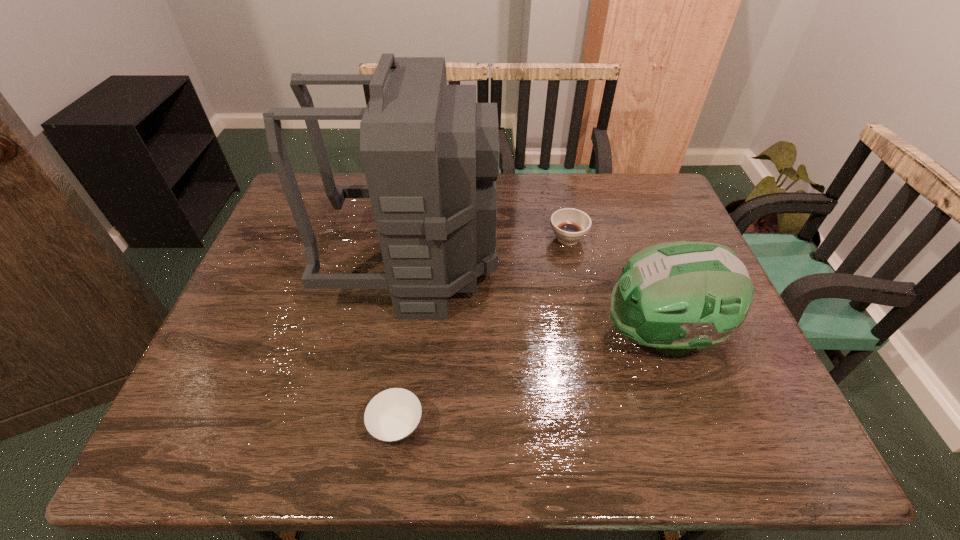
At what (x,y) coordinates should I click in order to perform the action: click on free spot located 0.310m on the back of the nearer soup bowl. Please return your answer as a coordinate pair (x, y). The width and height of the screenshot is (960, 540). Looking at the image, I should click on (416, 292).

Locate an element on the screen. object that is at the near edge is located at coordinates (392, 416).

Locate an element on the screen. The image size is (960, 540). object located at the right edge is located at coordinates (677, 296).

This screenshot has height=540, width=960. In the image, there is a desktop. Find the location of `vacant area at the far edge`. vacant area at the far edge is located at coordinates (567, 206).

Locate an element on the screen. vacant area at the near edge is located at coordinates 483,421.

The image size is (960, 540). I want to click on free region at the left edge of the desktop, so click(x=255, y=411).

Find the location of `vacant space at the near left corner of the desktop`. vacant space at the near left corner of the desktop is located at coordinates coord(240,449).

Where is `free region at the far right corner of the desktop`? This screenshot has height=540, width=960. free region at the far right corner of the desktop is located at coordinates (645, 210).

The width and height of the screenshot is (960, 540). Identify the location of vacant space that's between the football helmet and the nearer soup bowl. (528, 382).

Identify the location of vacant area that lies between the nearer soup bowl and the right soup bowl. This screenshot has height=540, width=960. (483, 333).